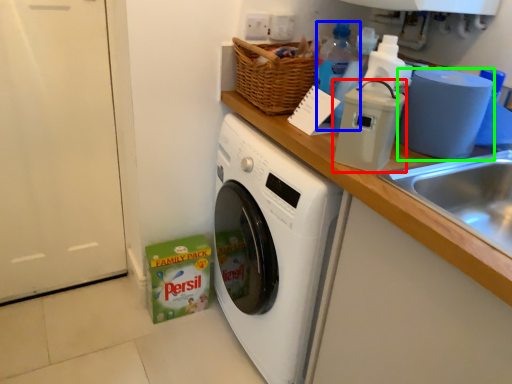
Question: Considering the real-world distances, which object is closest to appliance (highlighted by a red box)? bottle (highlighted by a blue box) or toilet paper (highlighted by a green box).

Choices:
 (A) bottle
 (B) toilet paper

Answer: (B)